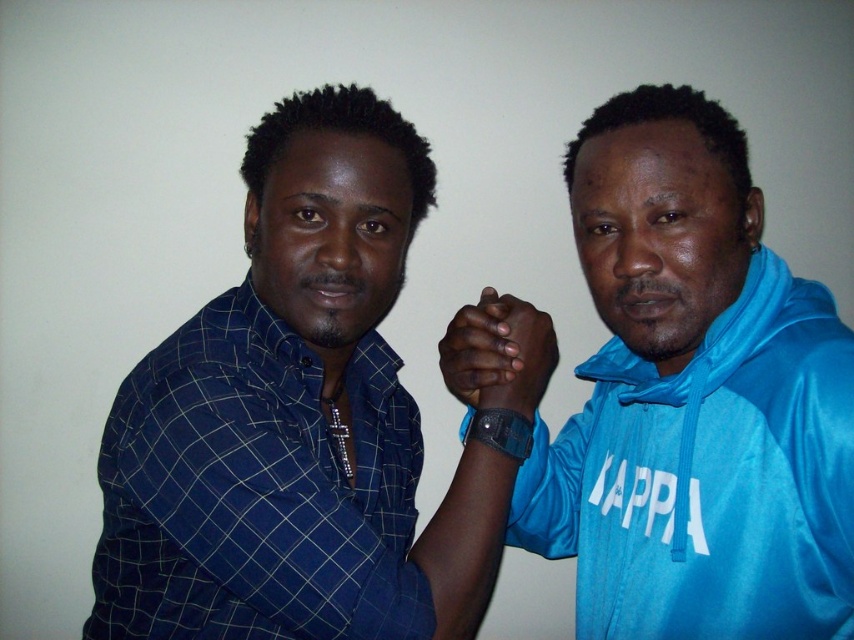
You are a photographer setting up a photo shoot. You need to ensure that the blue checkered shirt at left and the dark skin hand at center are both visible in the frame. Based on their sizes, which object should you prioritize positioning closer to the camera to maintain clarity?

The dark skin hand at center should be positioned closer to the camera since the blue checkered shirt at left is larger and will remain visible even if slightly farther away.

You are a photographer setting up a portrait. You need to ensure that the blue checkered shirt at left and the dark skin hand at center are both visible in the frame. Based on their sizes, which object should you focus on to ensure both fit comfortably?

The blue checkered shirt at left is wider than the dark skin hand at center. To ensure both fit comfortably in the frame, focus on positioning the camera to accommodate the wider blue checkered shirt at left first, as it requires more space.

You are a photographer setting up a shoot for two models. The scene requires the model in the blue checkered shirt at left to move to the right so they are no longer on the far left of the frame. Can you adjust their position without moving the model in the blue satin hoodie at center?

The blue checkered shirt at left is currently on the left side of the blue satin hoodie at center. To move the blue checkered shirt at left to the right without moving the blue satin hoodie at center, the model in the blue checkered shirt at left should shift their position to the right side of the blue satin hoodie at center.